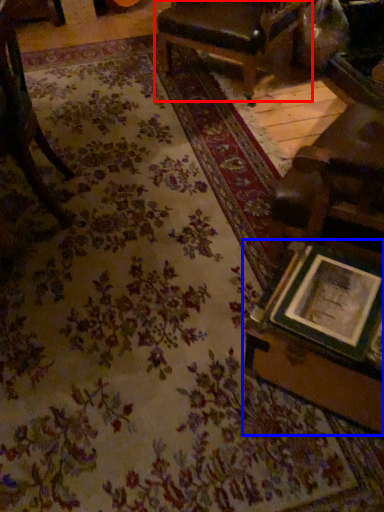
Question: Which point is further to the camera, chair (highlighted by a red box) or table (highlighted by a blue box)?

Choices:
 (A) chair
 (B) table

Answer: (A)